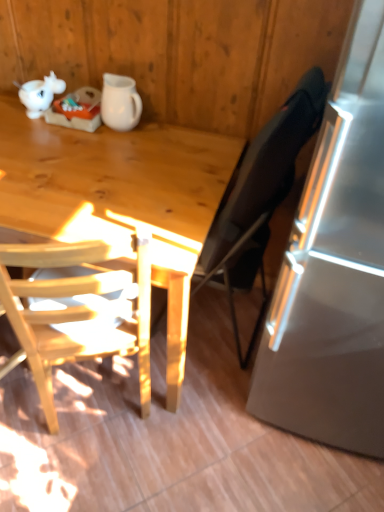
Identify the location of vacant area that is in front of light wood chair at left, positioned as the 1th chair in left-to-right order. (86, 471).